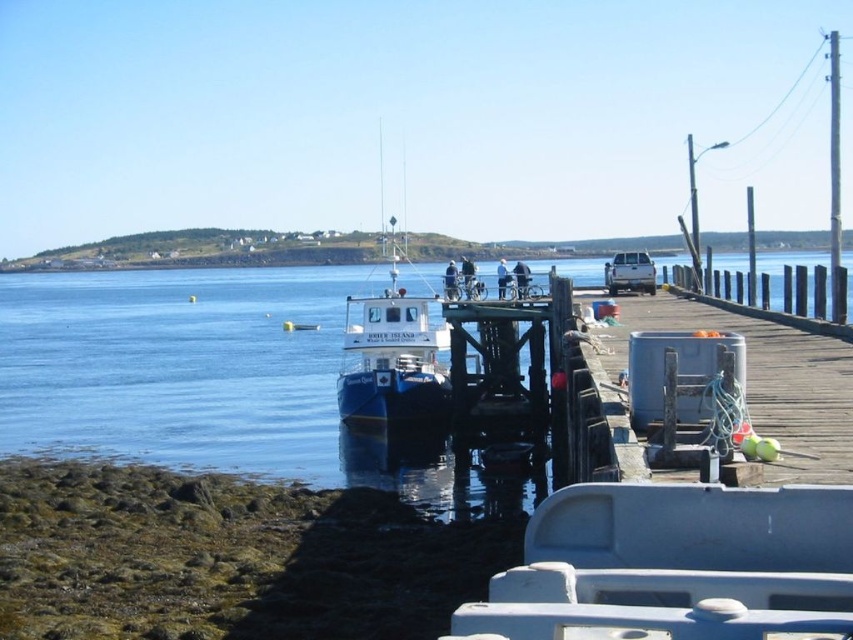
You are standing on the rocky shoreline and looking at the blue water at center and the blue matte boat at center. Which object is taller from your perspective?

The blue matte boat at center is taller than the blue water at center.